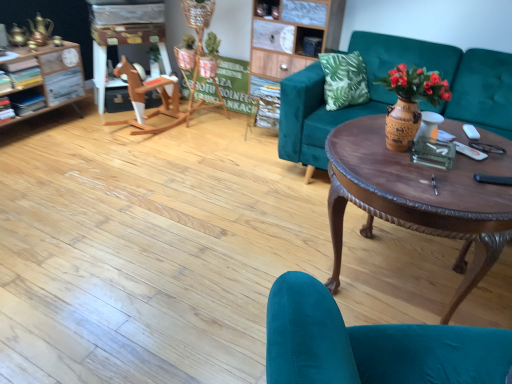
This screenshot has height=384, width=512. What are the coordinates of `vacant space to the left of teal velvet couch at center` in the screenshot? It's located at (206, 193).